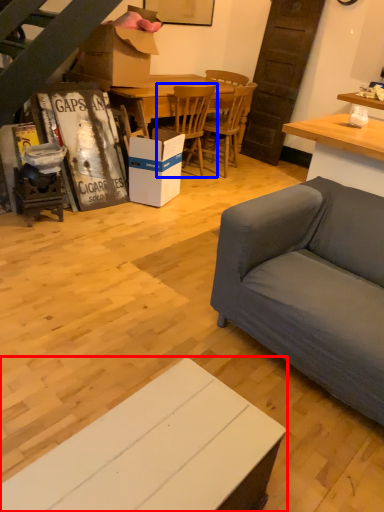
Question: Which of the following is the closest to the observer, cabinetry (highlighted by a red box) or chair (highlighted by a blue box)?

Choices:
 (A) cabinetry
 (B) chair

Answer: (A)